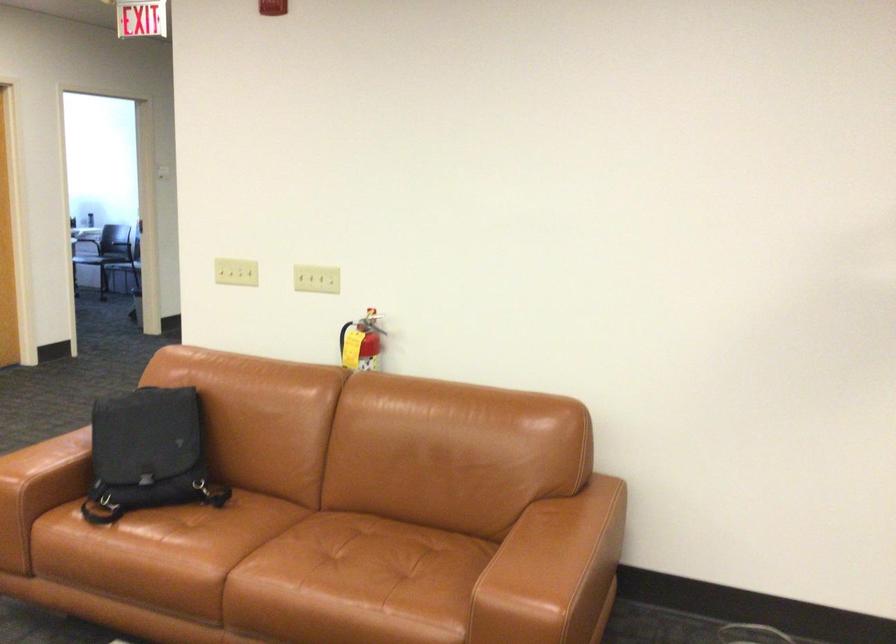
This screenshot has width=896, height=644. What do you see at coordinates (92, 514) in the screenshot? I see `a backpack strap` at bounding box center [92, 514].